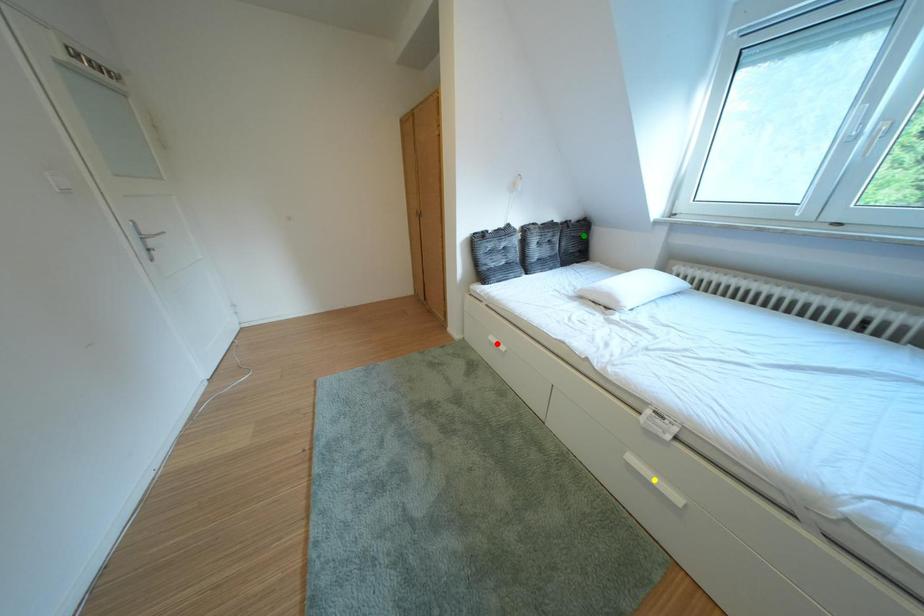
Order these from nearest to farthest:
A) green point
B) red point
C) yellow point

green point → red point → yellow point